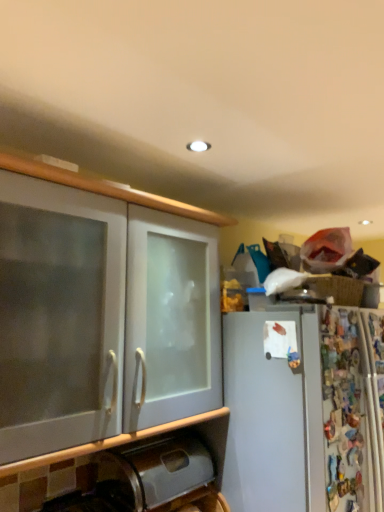
What do you see at coordinates (106, 343) in the screenshot? I see `white frosted glass cabinet at left` at bounding box center [106, 343].

Identify the location of white frosted glass cabinet at left. This screenshot has width=384, height=512. (106, 343).

What do you see at coordinates (154, 473) in the screenshot? I see `metallic stainless steel trash can at lower left` at bounding box center [154, 473].

Locate an element on the screen. This screenshot has height=512, width=384. metallic stainless steel trash can at lower left is located at coordinates (154, 473).

Identify the location of white frosted glass cabinet at left. This screenshot has height=512, width=384. (106, 343).

Is white frosted glass cabinet at left at the left side of metallic stainless steel trash can at lower left?

Yes, white frosted glass cabinet at left is to the left of metallic stainless steel trash can at lower left.

Considering the relative positions of white frosted glass cabinet at left and metallic stainless steel trash can at lower left in the image provided, is white frosted glass cabinet at left in front of metallic stainless steel trash can at lower left?

Yes, it is in front of metallic stainless steel trash can at lower left.

Is point (40, 494) more distant than point (145, 455)?

No, it is in front of (145, 455).

From the image's perspective, is white frosted glass cabinet at left over metallic stainless steel trash can at lower left?

Yes, from the image's perspective, white frosted glass cabinet at left is above metallic stainless steel trash can at lower left.

From a real-world perspective, is white frosted glass cabinet at left located beneath metallic stainless steel trash can at lower left?

No, from a real-world perspective, white frosted glass cabinet at left is not beneath metallic stainless steel trash can at lower left.

Between white frosted glass cabinet at left and metallic stainless steel trash can at lower left, which one has smaller width?

metallic stainless steel trash can at lower left is thinner.

Between white frosted glass cabinet at left and metallic stainless steel trash can at lower left, which one has more height?

Standing taller between the two is white frosted glass cabinet at left.

Which of these two, white frosted glass cabinet at left or metallic stainless steel trash can at lower left, is smaller?

Smaller between the two is metallic stainless steel trash can at lower left.

Would you say metallic stainless steel trash can at lower left is part of white frosted glass cabinet at left's contents?

No, metallic stainless steel trash can at lower left is located outside of white frosted glass cabinet at left.

Are white frosted glass cabinet at left and metallic stainless steel trash can at lower left beside each other?

No, white frosted glass cabinet at left is not with metallic stainless steel trash can at lower left.

Is white frosted glass cabinet at left positioned with its back to metallic stainless steel trash can at lower left?

white frosted glass cabinet at left does not have its back to metallic stainless steel trash can at lower left.

Measure the distance between white frosted glass cabinet at left and metallic stainless steel trash can at lower left.

white frosted glass cabinet at left and metallic stainless steel trash can at lower left are 10.72 inches apart from each other.

This screenshot has width=384, height=512. Find the location of `appliance below the white frosted glass cabinet at left (from a real-world perspective)`. appliance below the white frosted glass cabinet at left (from a real-world perspective) is located at coordinates (154, 473).

Is metallic stainless steel trash can at lower left at the left side of white frosted glass cabinet at left?

In fact, metallic stainless steel trash can at lower left is to the right of white frosted glass cabinet at left.

Between metallic stainless steel trash can at lower left and white frosted glass cabinet at left, which one is positioned behind?

metallic stainless steel trash can at lower left is further away from the camera.

Is point (102, 470) more distant than point (35, 220)?

Yes, point (102, 470) is behind point (35, 220).

From the image's perspective, is metallic stainless steel trash can at lower left beneath white frosted glass cabinet at left?

Yes.

From a real-world perspective, between metallic stainless steel trash can at lower left and white frosted glass cabinet at left, who is vertically higher?

From a 3D spatial view, white frosted glass cabinet at left is above.

Considering the sizes of objects metallic stainless steel trash can at lower left and white frosted glass cabinet at left in the image provided, who is wider, metallic stainless steel trash can at lower left or white frosted glass cabinet at left?

With larger width is white frosted glass cabinet at left.

Is metallic stainless steel trash can at lower left taller than white frosted glass cabinet at left?

No.

Between metallic stainless steel trash can at lower left and white frosted glass cabinet at left, which one has larger size?

white frosted glass cabinet at left.

Is white frosted glass cabinet at left located within metallic stainless steel trash can at lower left?

No.

Are metallic stainless steel trash can at lower left and white frosted glass cabinet at left beside each other?

No, metallic stainless steel trash can at lower left is not making contact with white frosted glass cabinet at left.

Is metallic stainless steel trash can at lower left aimed at white frosted glass cabinet at left?

No, metallic stainless steel trash can at lower left is not turned towards white frosted glass cabinet at left.

How many degrees apart are the facing directions of metallic stainless steel trash can at lower left and white frosted glass cabinet at left?

They differ by 0.000909 degrees in their facing directions.

How far apart are metallic stainless steel trash can at lower left and white frosted glass cabinet at left?

They are 10.72 inches apart.

Locate an element on the screen. The height and width of the screenshot is (512, 384). cabinetry in front of the metallic stainless steel trash can at lower left is located at coordinates (106, 343).

Find the location of a particular element. appliance on the right of white frosted glass cabinet at left is located at coordinates (154, 473).

Locate an element on the screen. The width and height of the screenshot is (384, 512). appliance below the white frosted glass cabinet at left (from the image's perspective) is located at coordinates (154, 473).